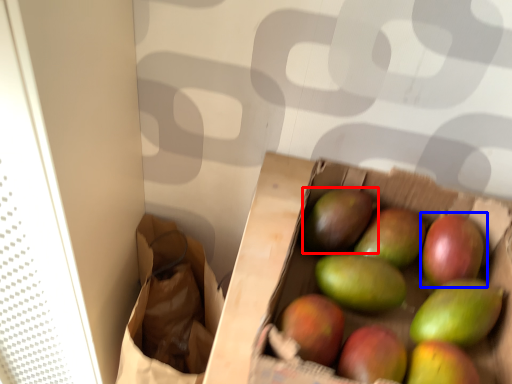
Question: Which of the following is the closest to the observer, mango (highlighted by a red box) or grapefruit (highlighted by a blue box)?

Choices:
 (A) mango
 (B) grapefruit

Answer: (B)